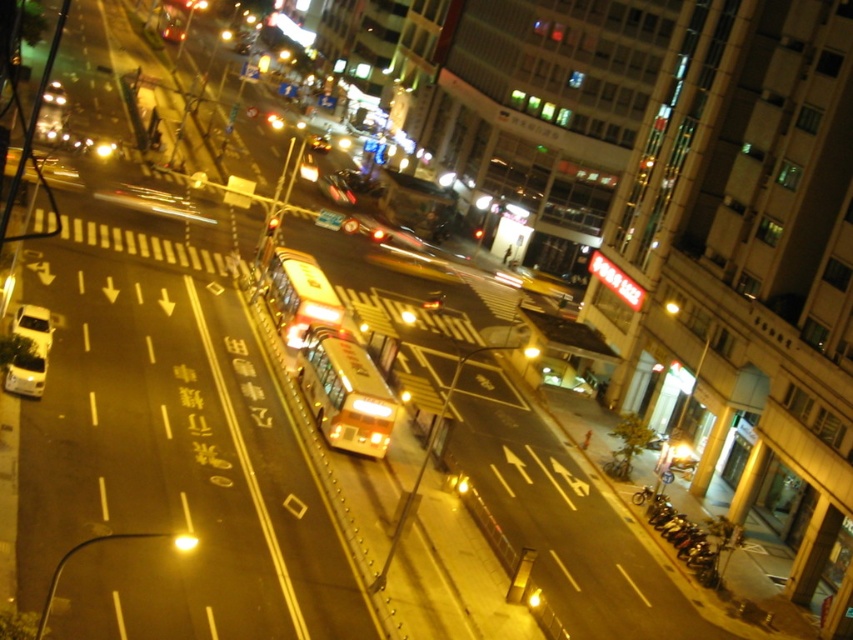
Does metallic orange bus at center have a greater width compared to metallic gold bus at center?

Incorrect, metallic orange bus at center's width does not surpass metallic gold bus at center's.

Between metallic orange bus at center and metallic gold bus at center, which one has more height?

With more height is metallic gold bus at center.

You are a GUI agent. You are given a task and a screenshot of the screen. Output one action in this format:
    pyautogui.click(x=<x>, y=<y>)
    Task: Click on the metallic orange bus at center
    
    Given the screenshot: What is the action you would take?
    pyautogui.click(x=299, y=296)

Where is `metallic orange bus at center`? This screenshot has height=640, width=853. metallic orange bus at center is located at coordinates (299, 296).

Between yellow metallic bus at center and metallic gold bus at center, which one is positioned higher?

metallic gold bus at center

Which is behind, point (358, 435) or point (412, 232)?

Point (412, 232)

You are a GUI agent. You are given a task and a screenshot of the screen. Output one action in this format:
    pyautogui.click(x=<x>, y=<y>)
    Task: Click on the yellow metallic bus at center
    
    Given the screenshot: What is the action you would take?
    pyautogui.click(x=345, y=392)

In the scene shown: Can you confirm if yellow metallic bus at center is positioned above metallic orange bus at center?

Actually, yellow metallic bus at center is below metallic orange bus at center.

Is yellow metallic bus at center smaller than metallic orange bus at center?

Correct, yellow metallic bus at center occupies less space than metallic orange bus at center.

Is point (357, 417) more distant than point (270, 288)?

No, it is not.

The height and width of the screenshot is (640, 853). What are the coordinates of `yellow metallic bus at center` in the screenshot? It's located at (345, 392).